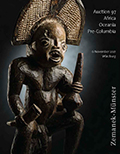
In order to click on statue in this screenshot , I will do `click(48, 84)`.